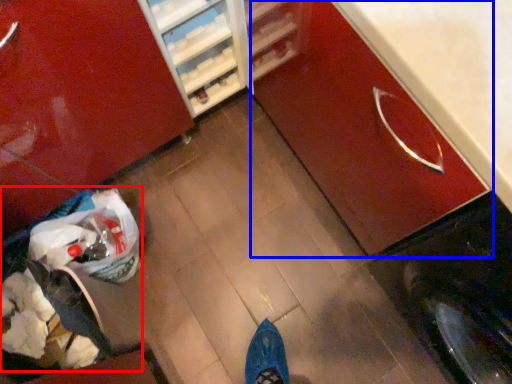
Question: Which point is further to the camera, garbage (highlighted by a red box) or cabinetry (highlighted by a blue box)?

Choices:
 (A) garbage
 (B) cabinetry

Answer: (A)